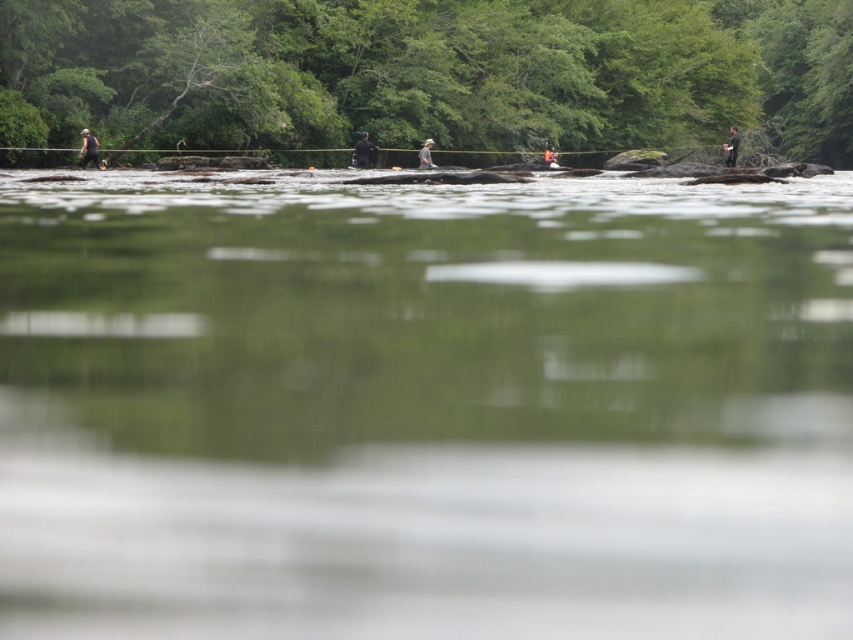
You are navigating a small boat along the river in the image. You see two points marked on your map as point (402, 93) and point (556, 164). Which point should you aim for first to stay in the deeper part of the river?

Point (402, 93) is behind point (556, 164), so you should aim for point (556, 164) first as it is closer to your current position and likely in deeper water.

You are a photographer trying to capture a clear image of the dark gray fabric jacket at center from your camera. The camera is 160.98 feet away from the jacket. Considering the typical maximum effective range of a consumer camera lens, can you expect to get a clear photo of the jacket from this distance?

The dark gray fabric jacket at center and camera are 160.98 feet apart. Consumer camera lenses typically have an effective range up to around 100 feet for clear detail. At 160.98 feet, the jacket may appear blurry or lack sharpness in the photo.

You are an observer standing at the edge of the stream. You notice the green leafy tree at upper center and the orange life vest at center. Which object is closer to you?

The green leafy tree at upper center is closer to the viewer than the orange life vest at center.